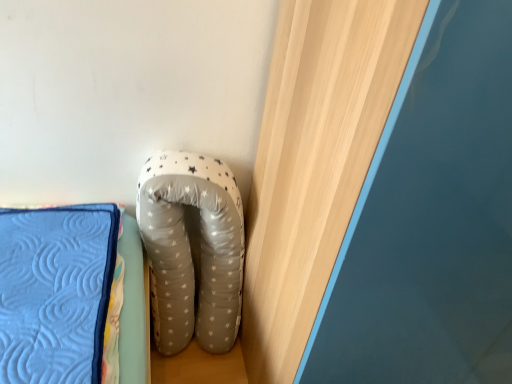
Question: Is white dotted fabric pillow at center in front of or behind wooden at upper right in the image?

Choices:
 (A) front
 (B) behind

Answer: (B)

Question: Visually, is white dotted fabric pillow at center positioned to the left or to the right of wooden at upper right?

Choices:
 (A) right
 (B) left

Answer: (B)

Question: From the image's perspective, is white dotted fabric pillow at center positioned above or below wooden at upper right?

Choices:
 (A) below
 (B) above

Answer: (A)

Question: From the image's perspective, is wooden at upper right positioned above or below white dotted fabric pillow at center?

Choices:
 (A) below
 (B) above

Answer: (B)

Question: Looking at their shapes, would you say wooden at upper right is wider or thinner than white dotted fabric pillow at center?

Choices:
 (A) thin
 (B) wide

Answer: (B)

Question: From a real-world perspective, is wooden at upper right positioned above or below white dotted fabric pillow at center?

Choices:
 (A) above
 (B) below

Answer: (A)

Question: In the image, is wooden at upper right positioned in front of or behind white dotted fabric pillow at center?

Choices:
 (A) behind
 (B) front

Answer: (B)